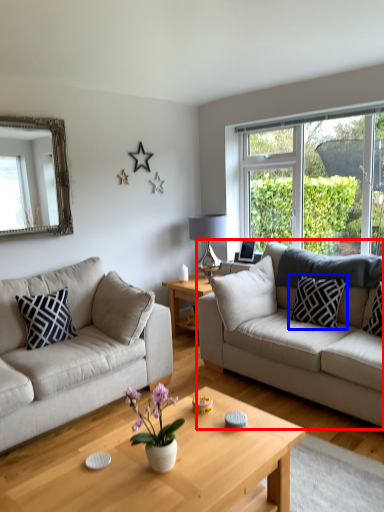
Question: Which of the following is the farthest to the observer, studio couch (highlighted by a red box) or pillow (highlighted by a blue box)?

Choices:
 (A) studio couch
 (B) pillow

Answer: (B)